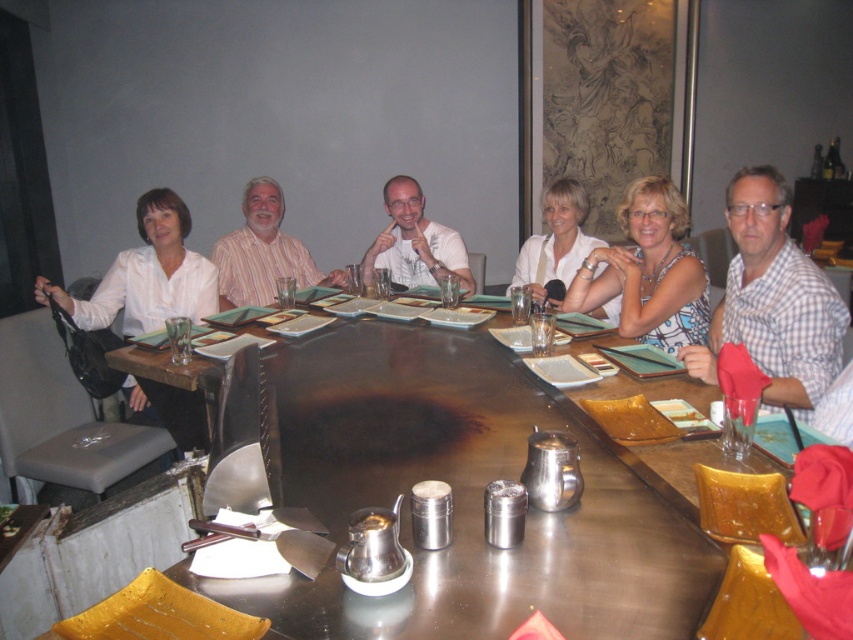
You are a photographer trying to capture a candid shot of the group. You notice the white checkered shirt at right and the striped cotton shirt at center. Which shirt should you focus on to ensure it appears taller in the photo?

The white checkered shirt at right has a greater height compared to the striped cotton shirt at center, so focusing on it will ensure the taller shirt is captured.